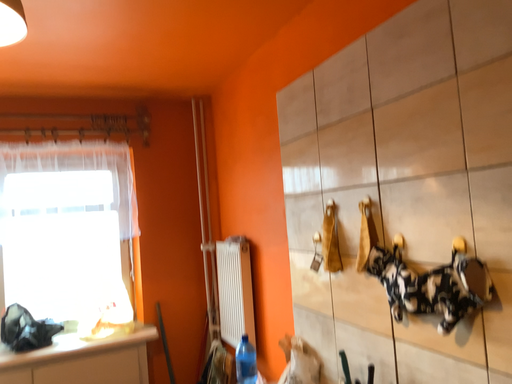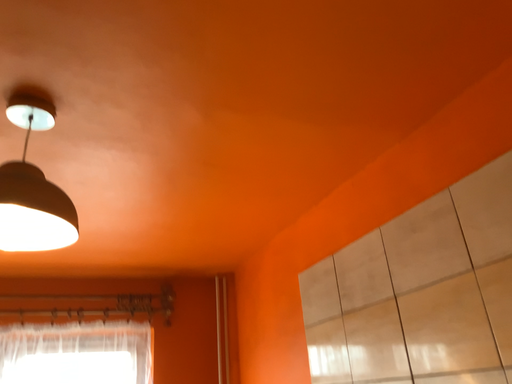
Question: Which way did the camera rotate in the video?

Choices:
 (A) rotated downward
 (B) rotated upward

Answer: (B)